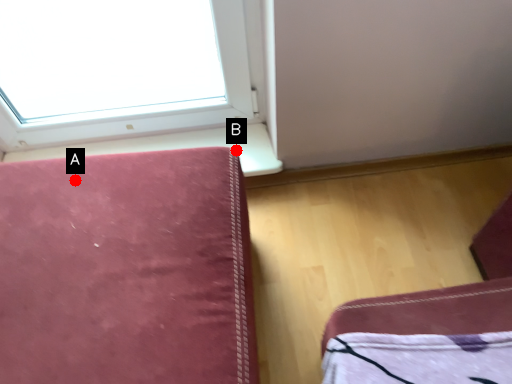
Question: Two points are circled on the image, labeled by A and B beside each circle. Which of the following is the closest to the observer?

Choices:
 (A) A is closer
 (B) B is closer

Answer: (A)